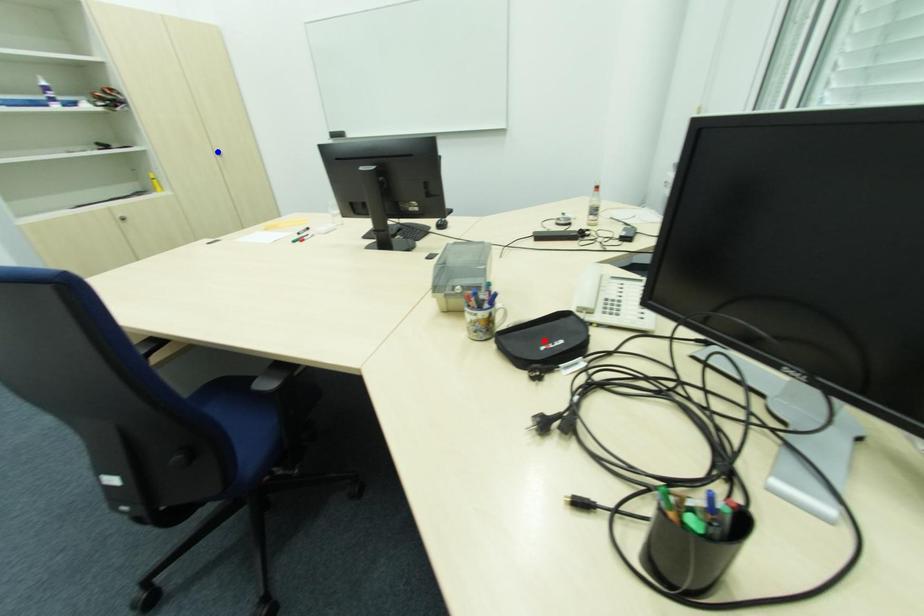
Question: In the image, two points are highlighted. Which point is nearer to the camera? Reply with the corresponding letter.

Choices:
 (A) blue point
 (B) red point

Answer: (B)